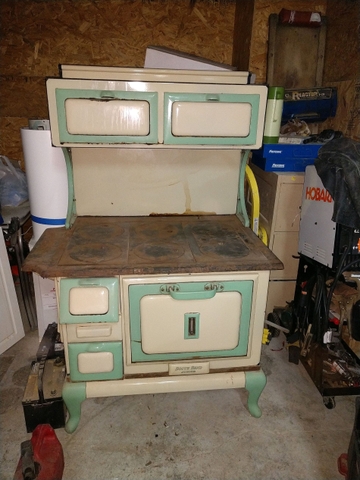
Where is `stove`? stove is located at coordinates (162, 253).